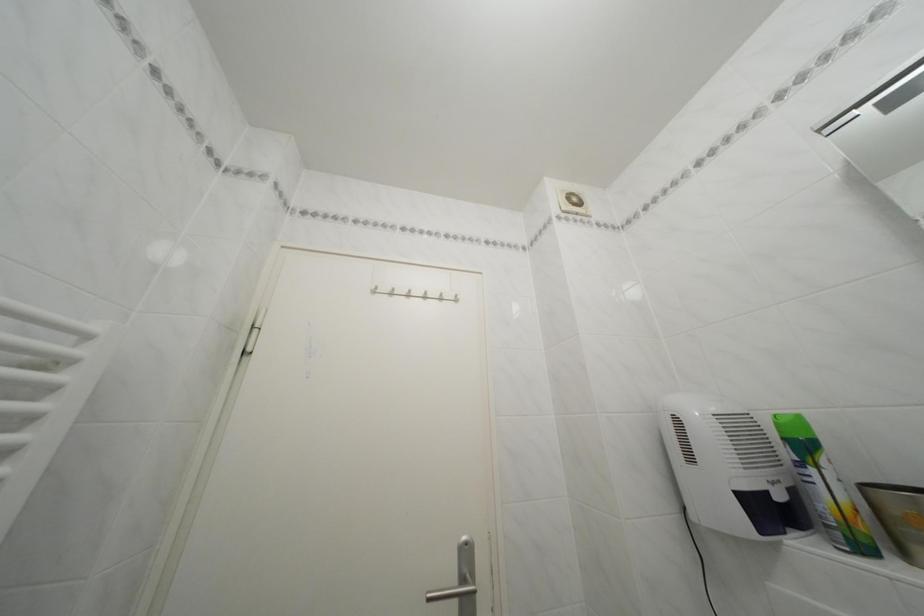
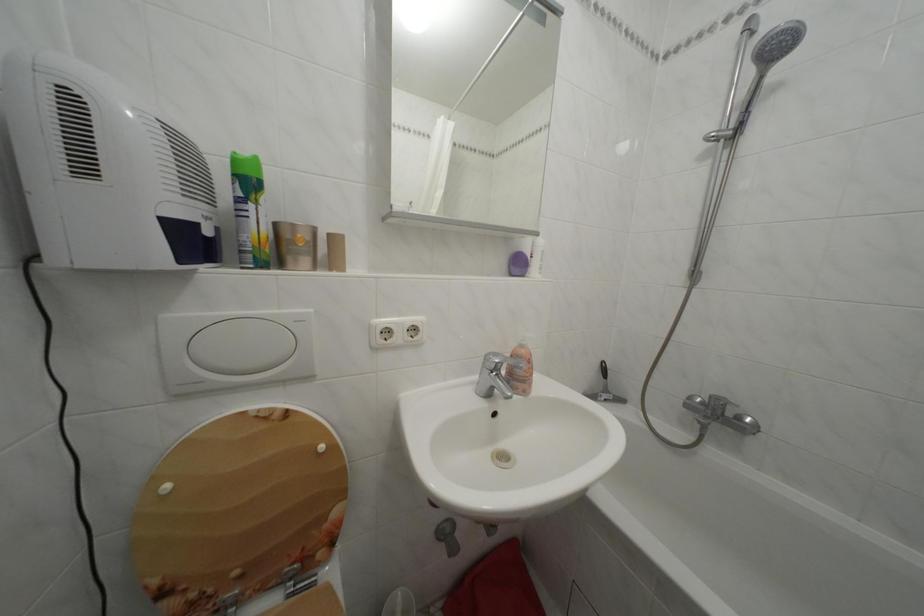
Question: Based on the continuous images, in which direction is the camera rotating? Reply with the corresponding letter.

Choices:
 (A) Left
 (B) Right
 (C) Up
 (D) Down

Answer: (B)